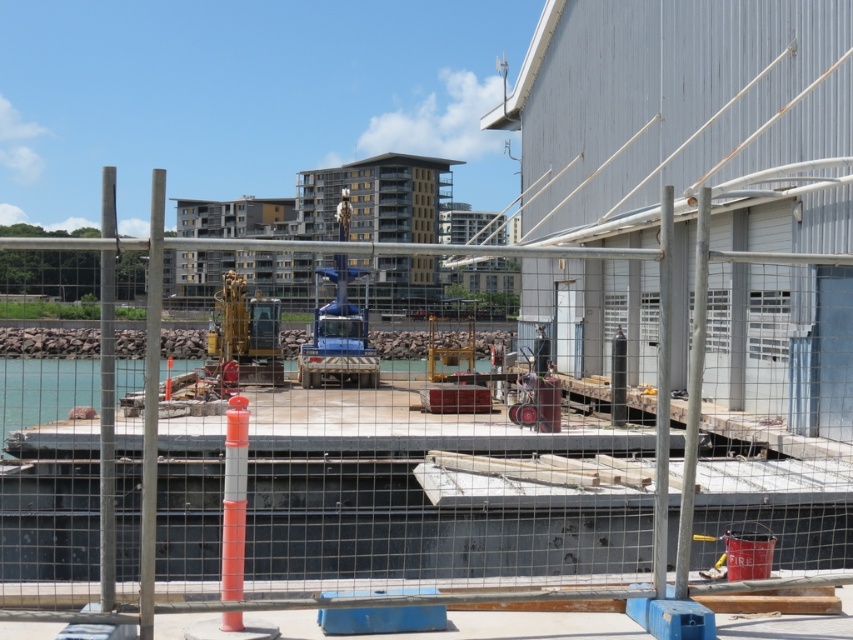
Question: Which point is farther to the camera?

Choices:
 (A) gold metallic excavator at center
 (B) blue metallic crane at center
 (C) matte concrete platform at center
 (D) clear water at center

Answer: (A)

Question: Is the position of matte concrete platform at center more distant than that of clear water at center?

Choices:
 (A) no
 (B) yes

Answer: (A)

Question: Which of the following is the closest to the observer?

Choices:
 (A) blue metallic crane at center
 (B) clear water at center

Answer: (A)

Question: Does clear water at center appear under gold metallic excavator at center?

Choices:
 (A) no
 (B) yes

Answer: (B)

Question: Which point is closer to the camera taking this photo?

Choices:
 (A) coord(364,310)
 (B) coord(422,531)
 (C) coord(267,365)
 (D) coord(80,404)

Answer: (B)

Question: Is matte concrete platform at center below clear water at center?

Choices:
 (A) no
 (B) yes

Answer: (A)